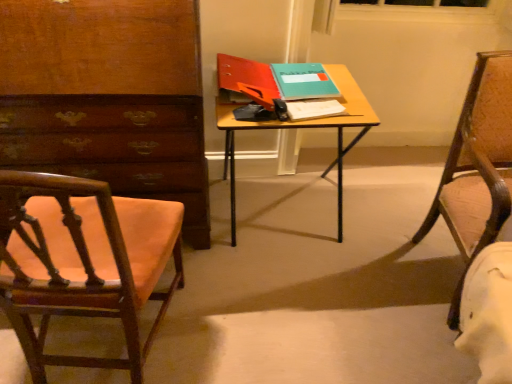
The height and width of the screenshot is (384, 512). What are the coordinates of `free region under teal matte book at center, the 2th book from the left (from a real-world perspective)` in the screenshot? It's located at (307, 91).